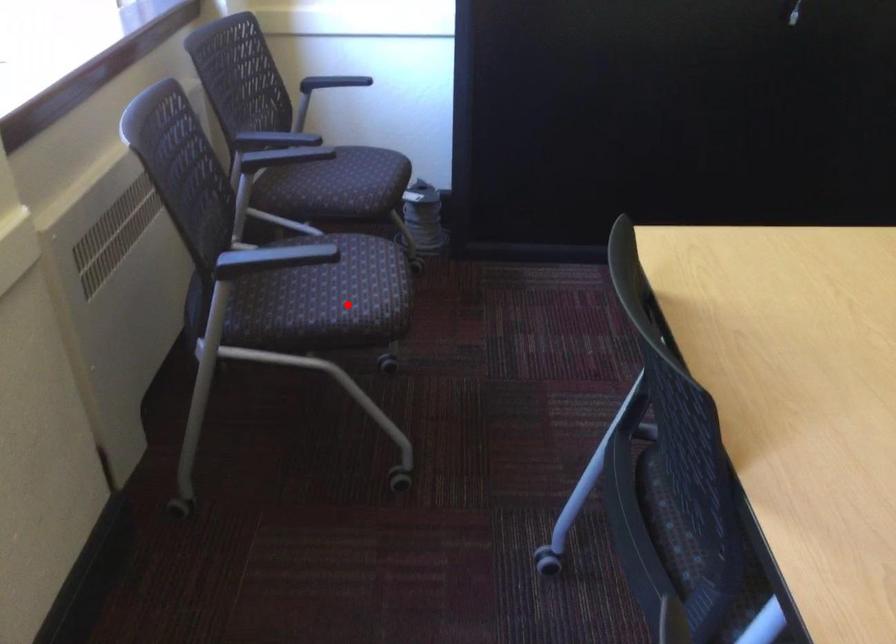
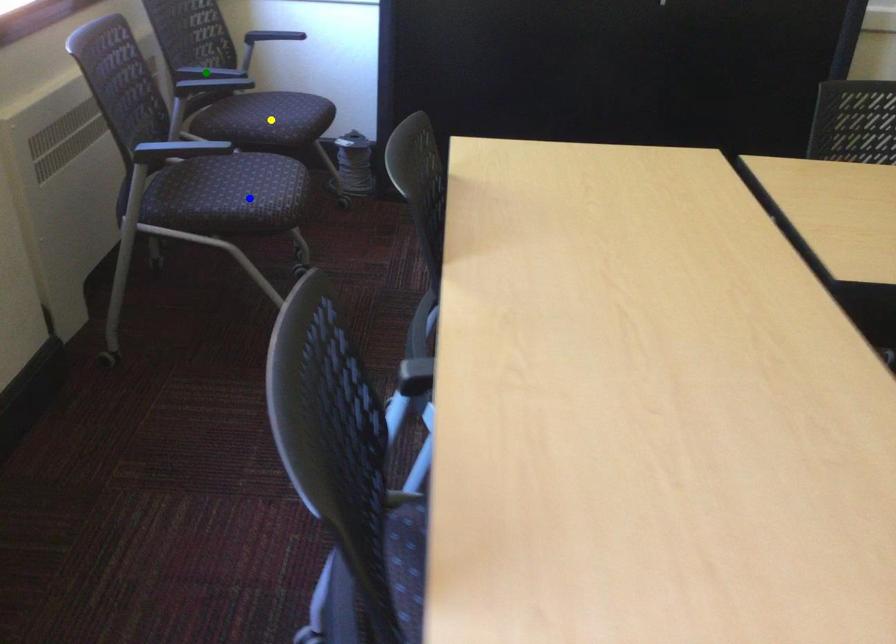
Question: I am providing you with two images of the same scene from different viewpoints. A red point is marked on the first image. You are given multiple points on the second image. In image 2, which mark is for the same physical point as the one in image 1?

Choices:
 (A) blue point
 (B) yellow point
 (C) green point

Answer: (A)